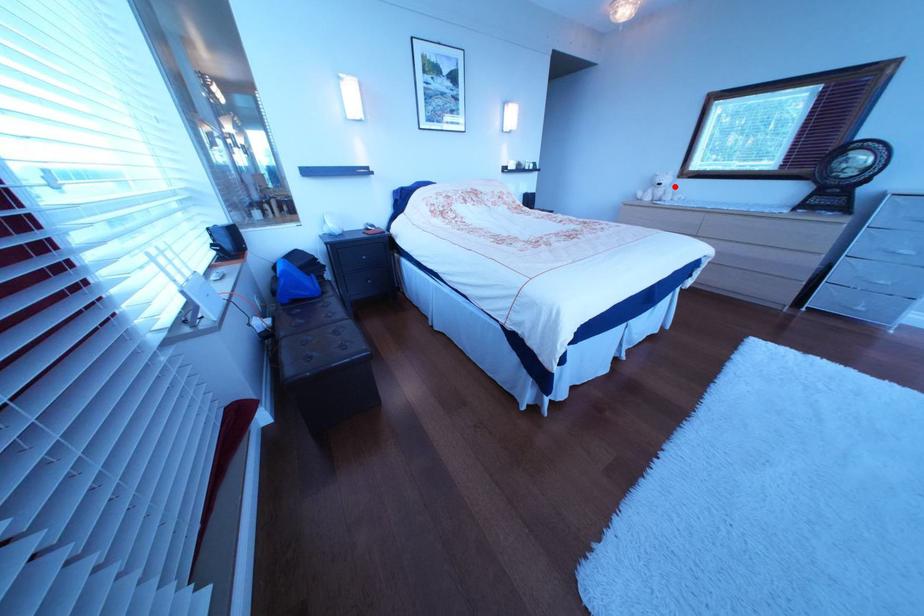
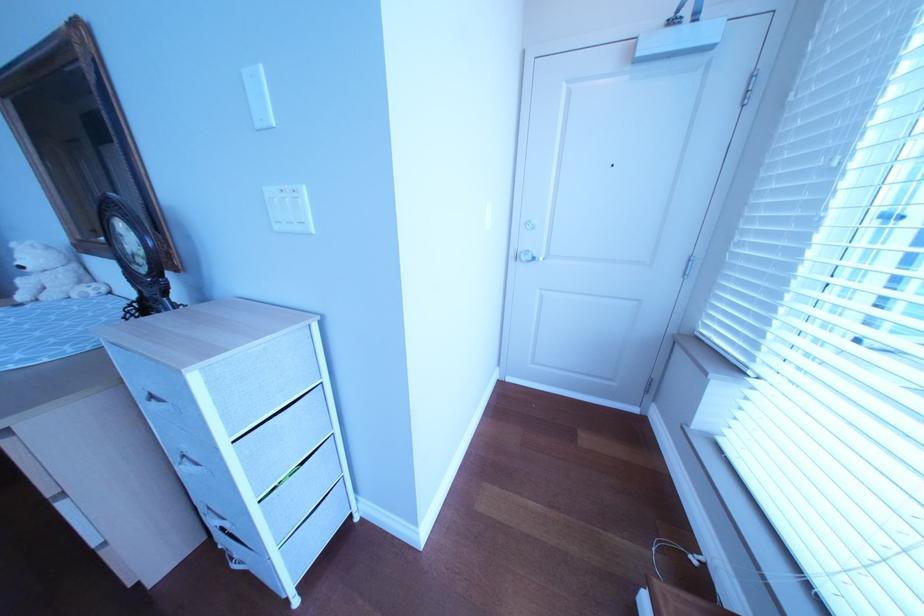
In the second image, find the point that corresponds to the highlighted location in the first image.

(37, 270)